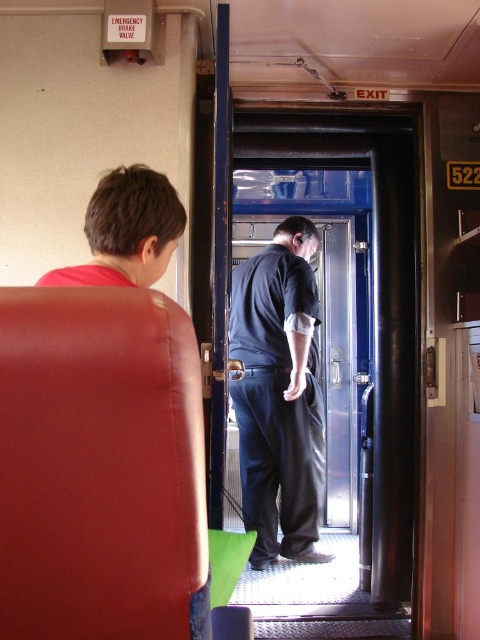
You are standing at the center of the train car and want to sit down on the matte leather seat at left. Which direction should you move to reach it?

The matte leather seat at left is located at point (x=99, y=467), so you should move to the left to reach it.

You are standing inside the train car and want to exit through the door. There are two points marked on the floor at coordinates point (274, 332) and point (73, 272). Which point is closer to the exit door?

Point (274, 332) is behind point (73, 272), so the closer point to the exit door is point (73, 272).